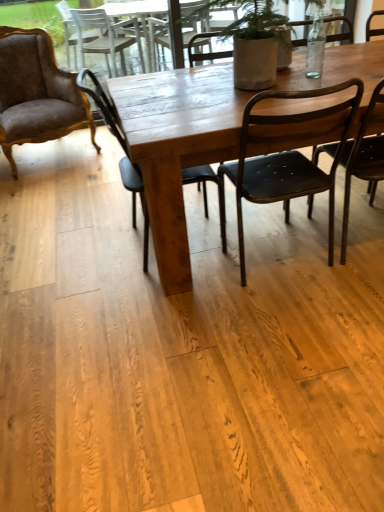
Question: Does wooden table at center appear on the left side of matte black chair at center, the 3th chair viewed from the right?

Choices:
 (A) yes
 (B) no

Answer: (B)

Question: From the image's perspective, would you say wooden table at center is shown under matte black chair at center, the 3th chair viewed from the right?

Choices:
 (A) yes
 (B) no

Answer: (B)

Question: Considering the relative positions of wooden table at center and matte black chair at center, the 3th chair viewed from the right, in the image provided, is wooden table at center to the right of matte black chair at center, the 3th chair viewed from the right, from the viewer's perspective?

Choices:
 (A) yes
 (B) no

Answer: (A)

Question: Is the depth of wooden table at center greater than that of matte black chair at center, the 3th chair viewed from the right?

Choices:
 (A) yes
 (B) no

Answer: (B)

Question: Can we say wooden table at center lies outside matte black chair at center, the 3th chair viewed from the right?

Choices:
 (A) no
 (B) yes

Answer: (B)

Question: Which is correct: velvet brown armchair at left, arranged as the 4th chair when viewed from the right, is inside matte black chair at center, positioned as the 2th chair in left-to-right order, or outside of it?

Choices:
 (A) outside
 (B) inside

Answer: (A)

Question: From the image's perspective, is velvet brown armchair at left, arranged as the 4th chair when viewed from the right, positioned above or below matte black chair at center, the 3th chair viewed from the right?

Choices:
 (A) below
 (B) above

Answer: (B)

Question: From their relative heights in the image, would you say velvet brown armchair at left, arranged as the 4th chair when viewed from the right, is taller or shorter than matte black chair at center, positioned as the 2th chair in left-to-right order?

Choices:
 (A) short
 (B) tall

Answer: (A)

Question: Looking at their shapes, would you say velvet brown armchair at left, arranged as the 4th chair when viewed from the right, is wider or thinner than matte black chair at center, positioned as the 2th chair in left-to-right order?

Choices:
 (A) wide
 (B) thin

Answer: (A)

Question: Is matte black chair at center, the 3th chair viewed from the right, situated inside velvet brown armchair at left, placed as the 1th chair when sorted from left to right, or outside?

Choices:
 (A) outside
 (B) inside

Answer: (A)

Question: From the image's perspective, is matte black chair at center, the 3th chair viewed from the right, positioned above or below velvet brown armchair at left, placed as the 1th chair when sorted from left to right?

Choices:
 (A) below
 (B) above

Answer: (A)

Question: From a real-world perspective, relative to velvet brown armchair at left, arranged as the 4th chair when viewed from the right, is matte black chair at center, positioned as the 2th chair in left-to-right order, vertically above or below?

Choices:
 (A) above
 (B) below

Answer: (B)

Question: In the image, is matte black chair at center, positioned as the 2th chair in left-to-right order, positioned in front of or behind velvet brown armchair at left, arranged as the 4th chair when viewed from the right?

Choices:
 (A) front
 (B) behind

Answer: (A)

Question: Visually, is black metal chair at center, the third chair in the left-to-right sequence, positioned to the left or to the right of matte black chair at center, positioned as the 2th chair in left-to-right order?

Choices:
 (A) right
 (B) left

Answer: (A)

Question: In terms of size, does black metal chair at center, which is the second chair in right-to-left order, appear bigger or smaller than matte black chair at center, positioned as the 2th chair in left-to-right order?

Choices:
 (A) big
 (B) small

Answer: (A)